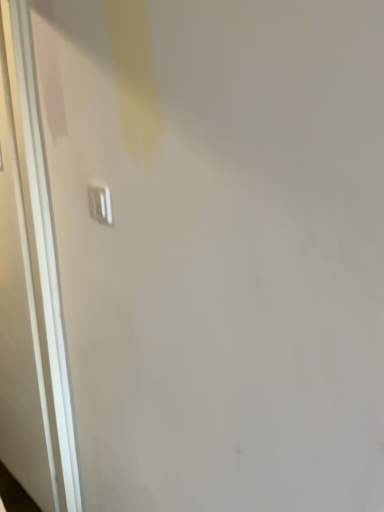
Question: From a real-world perspective, is white glossy door at left above or below white plastic light switch at upper left?

Choices:
 (A) below
 (B) above

Answer: (A)

Question: Looking at their shapes, would you say white glossy door at left is wider or thinner than white plastic light switch at upper left?

Choices:
 (A) thin
 (B) wide

Answer: (B)

Question: Is white glossy door at left situated inside white plastic light switch at upper left or outside?

Choices:
 (A) outside
 (B) inside

Answer: (A)

Question: From the image's perspective, is white plastic light switch at upper left positioned above or below white glossy door at left?

Choices:
 (A) below
 (B) above

Answer: (B)

Question: In terms of height, does white plastic light switch at upper left look taller or shorter compared to white glossy door at left?

Choices:
 (A) short
 (B) tall

Answer: (A)

Question: Considering their positions, is white plastic light switch at upper left located in front of or behind white glossy door at left?

Choices:
 (A) behind
 (B) front

Answer: (B)

Question: Is white plastic light switch at upper left inside the boundaries of white glossy door at left, or outside?

Choices:
 (A) inside
 (B) outside

Answer: (B)